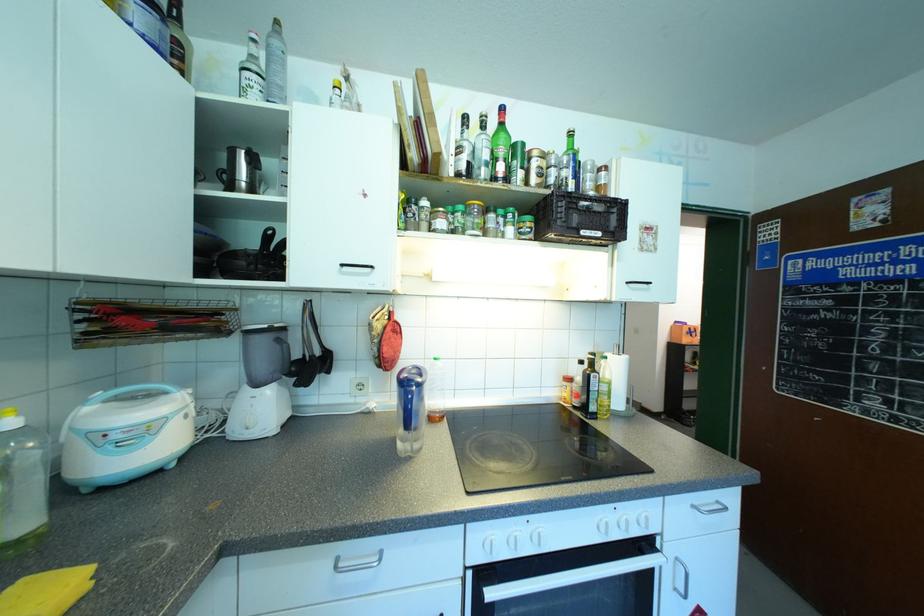
Which object does [500,148] point to?

It refers to a green glass bottle.